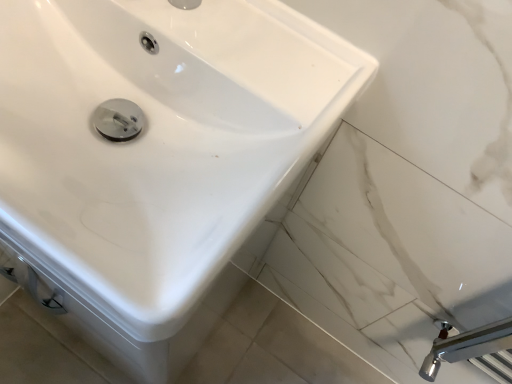
Where is `white glossy sink at upper left`? white glossy sink at upper left is located at coordinates (159, 139).

Image resolution: width=512 pixels, height=384 pixels. What do you see at coordinates (159, 139) in the screenshot? I see `white glossy sink at upper left` at bounding box center [159, 139].

You are a GUI agent. You are given a task and a screenshot of the screen. Output one action in this format:
    pyautogui.click(x=<x>, y=<y>)
    Task: Click on the white glossy sink at upper left
    
    Given the screenshot: What is the action you would take?
    pyautogui.click(x=159, y=139)